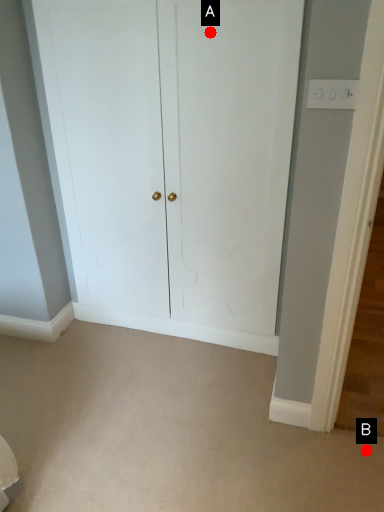
Question: Two points are circled on the image, labeled by A and B beside each circle. Which point is closer to the camera?

Choices:
 (A) A is closer
 (B) B is closer

Answer: (A)